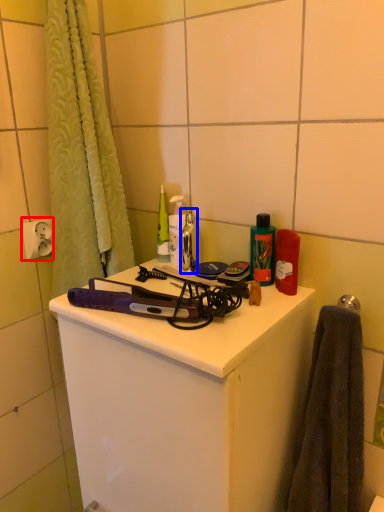
Question: Which of the following is the farthest to the observer, electric outlet (highlighted by a red box) or faucet (highlighted by a blue box)?

Choices:
 (A) electric outlet
 (B) faucet

Answer: (A)